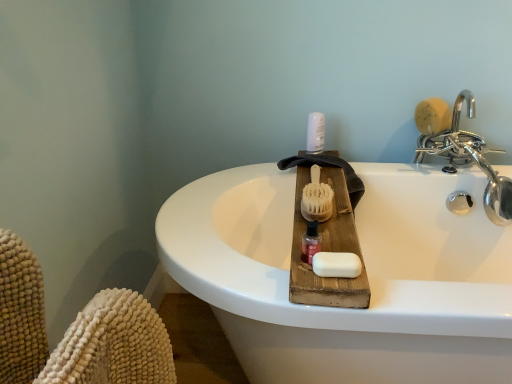
In order to click on free area in between wooden bristle brush at center, marked as the first brush in a bottom-to-top arrangement, and pink glossy bottle at center in this screenshot , I will do `click(316, 228)`.